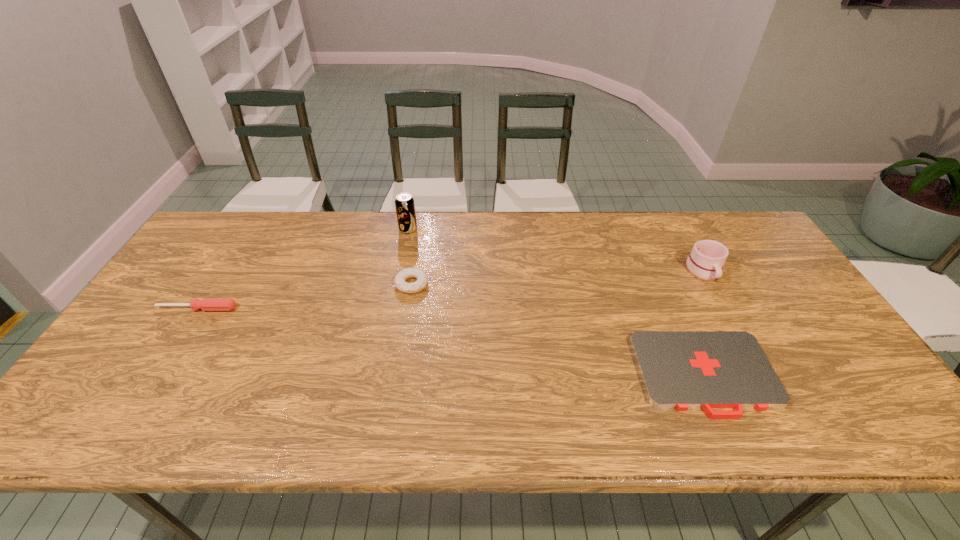
Identify the location of the tallest object. (404, 203).

Locate an element on the screen. Image resolution: width=960 pixels, height=540 pixels. the farthest object is located at coordinates (404, 203).

I want to click on the second tallest object, so click(705, 262).

You are a GUI agent. You are given a task and a screenshot of the screen. Output one action in this format:
    pyautogui.click(x=<x>, y=<y>)
    Task: Click on the doughnut
    
    Given the screenshot: What is the action you would take?
    pyautogui.click(x=422, y=278)

At what (x,y) coordinates should I click in order to perform the action: click on the fourth farthest object. Please return your answer as a coordinate pair (x, y). Looking at the image, I should click on (206, 304).

This screenshot has width=960, height=540. Identify the location of the leftmost object. (206, 304).

Image resolution: width=960 pixels, height=540 pixels. Identify the location of the shortest object. (679, 369).

The image size is (960, 540). Identify the location of the first-aid kit. (679, 369).

Locate an element on the screen. The width and height of the screenshot is (960, 540). vacant region located 0.180m on the front of the farthest object is located at coordinates (399, 272).

You are a GUI agent. You are given a task and a screenshot of the screen. Output one action in this format:
    pyautogui.click(x=<x>, y=<y>)
    Task: Click on the vacant space located 0.370m on the side with the handle of the second tallest object
    The image size is (960, 540).
    Given the screenshot: What is the action you would take?
    pyautogui.click(x=774, y=400)